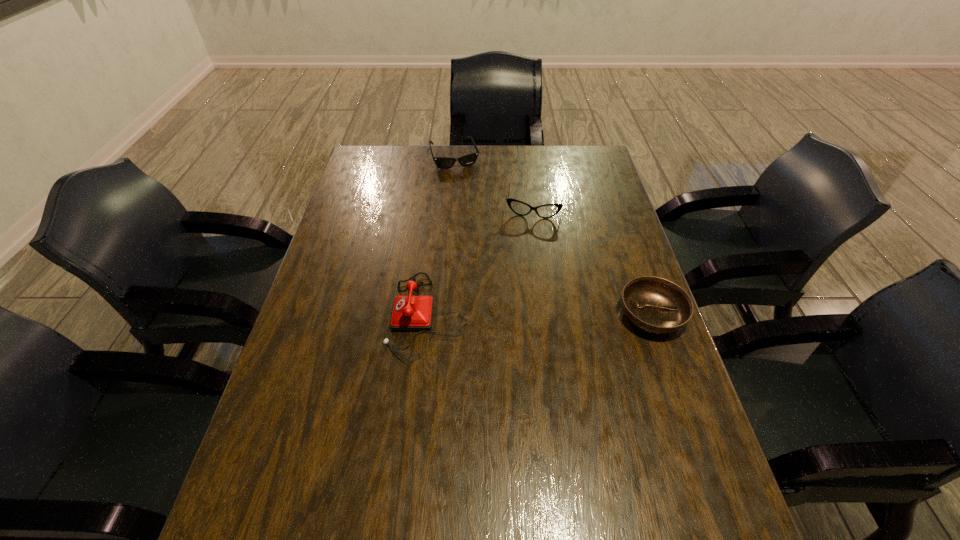
Locate an element on the screen. This screenshot has width=960, height=540. free space at the far left corner of the desktop is located at coordinates (357, 179).

Image resolution: width=960 pixels, height=540 pixels. In the image, there is a desktop. Identify the location of vacant space at the near left corner. (250, 456).

The width and height of the screenshot is (960, 540). In the image, there is a desktop. Find the location of `blank space at the far right corner`. blank space at the far right corner is located at coordinates (579, 152).

I want to click on free space between the sunglasses and the telephone, so click(x=442, y=237).

At what (x,y) coordinates should I click in order to perform the action: click on empty space between the farthest object and the rightmost object. Please return your answer as a coordinate pair (x, y). This screenshot has height=540, width=960. Looking at the image, I should click on (553, 237).

The width and height of the screenshot is (960, 540). I want to click on vacant area between the third object from left to right and the soup bowl, so click(593, 262).

The height and width of the screenshot is (540, 960). I want to click on vacant region between the spectacles and the rightmost object, so click(x=593, y=262).

The image size is (960, 540). Identify the location of free point between the sunglasses and the rightmost object. (553, 237).

What are the coordinates of `free point between the third nearest object and the farthest object` in the screenshot? It's located at click(494, 183).

At what (x,y) coordinates should I click in order to perform the action: click on vacant area that lies between the second farthest object and the farthest object. Please return your answer as a coordinate pair (x, y). This screenshot has height=540, width=960. Looking at the image, I should click on (494, 183).